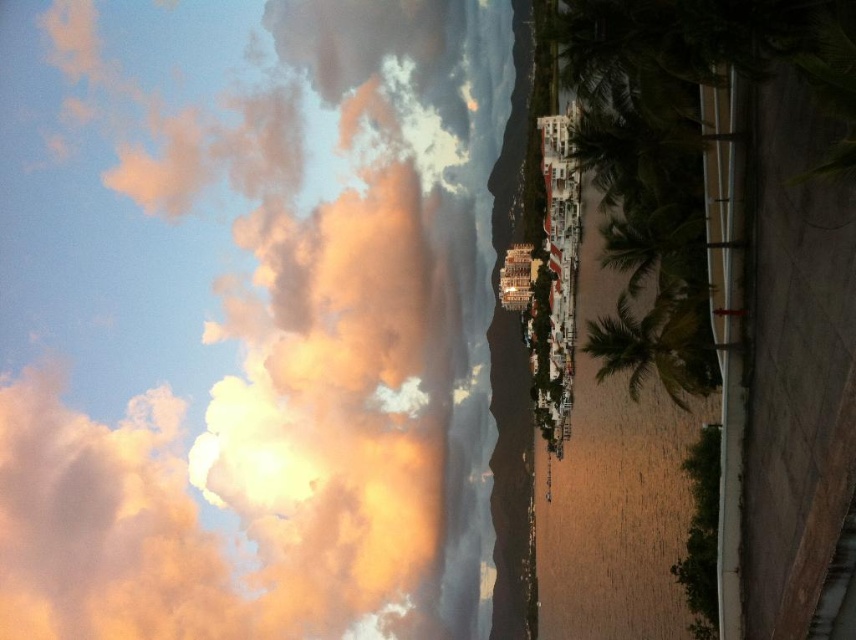
Question: Considering the relative positions of cloudy sky at upper left and green leafy palm tree at lower right in the image provided, where is cloudy sky at upper left located with respect to green leafy palm tree at lower right?

Choices:
 (A) above
 (B) below

Answer: (A)

Question: Is green leafy palm tree at lower right above green leafy palm tree at center-right?

Choices:
 (A) no
 (B) yes

Answer: (A)

Question: Is cloudy sky at upper left thinner than green leafy palm tree at lower right?

Choices:
 (A) no
 (B) yes

Answer: (A)

Question: Which point is farther to the camera?

Choices:
 (A) cloudy sky at upper left
 (B) green leafy palm tree at center-right

Answer: (A)

Question: Which point is farther to the camera?

Choices:
 (A) green leafy palm tree at center-right
 (B) green leafy palm tree at lower right

Answer: (B)

Question: Which object is farther from the camera taking this photo?

Choices:
 (A) cloudy sky at upper left
 (B) green leafy palm tree at lower right
 (C) green leafy palm tree at center-right

Answer: (A)